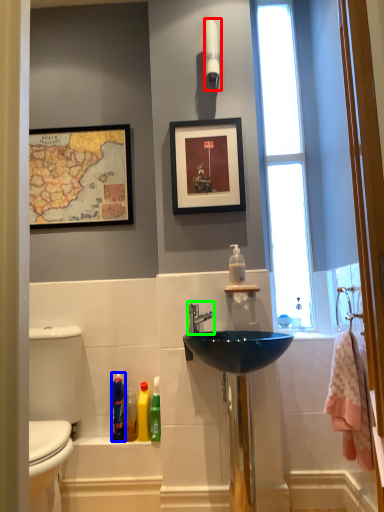
Question: Considering the real-world distances, which object is closest to light fixture (highlighted by a red box)? cleaning product (highlighted by a blue box) or tap (highlighted by a green box).

Choices:
 (A) cleaning product
 (B) tap

Answer: (B)